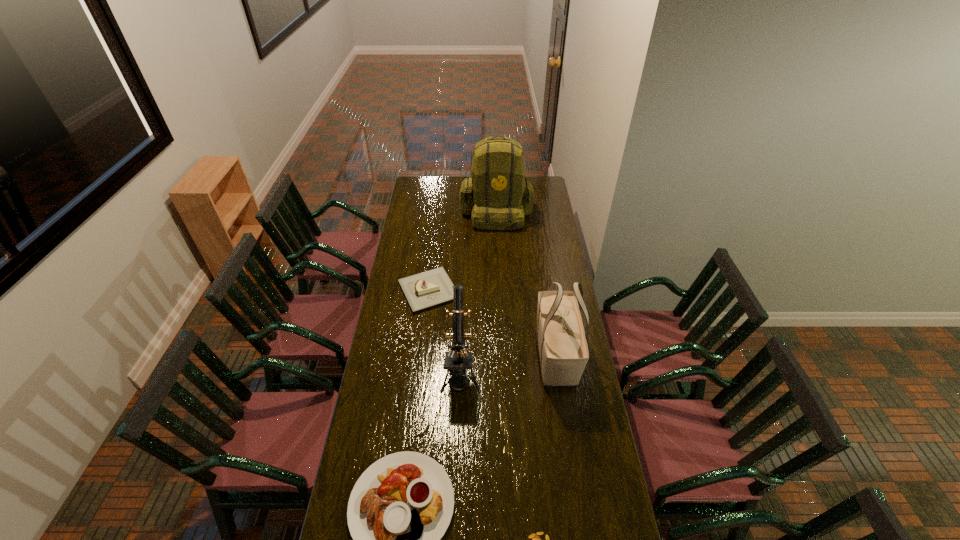
In order to click on the farthest object in this screenshot , I will do click(x=501, y=194).

Identify the location of shopping bag. (563, 351).

Where is `microscope`? microscope is located at coordinates (458, 359).

The height and width of the screenshot is (540, 960). I want to click on the fifth tallest object, so click(x=426, y=289).

I want to click on cake, so click(426, 289).

Where is `vacant space located on the front-facing side of the backpack`? vacant space located on the front-facing side of the backpack is located at coordinates (499, 277).

I want to click on free space located 0.400m with handles facing forward on the shopping bag, so click(577, 497).

This screenshot has width=960, height=540. Find the location of `vacant space located 0.280m through the eyepiece of the microscope`. vacant space located 0.280m through the eyepiece of the microscope is located at coordinates (456, 478).

This screenshot has height=540, width=960. In order to click on free space located 0.060m on the front of the fifth nearest object in this screenshot , I will do `click(425, 324)`.

Locate an element on the screen. This screenshot has width=960, height=540. object at the far edge is located at coordinates (501, 194).